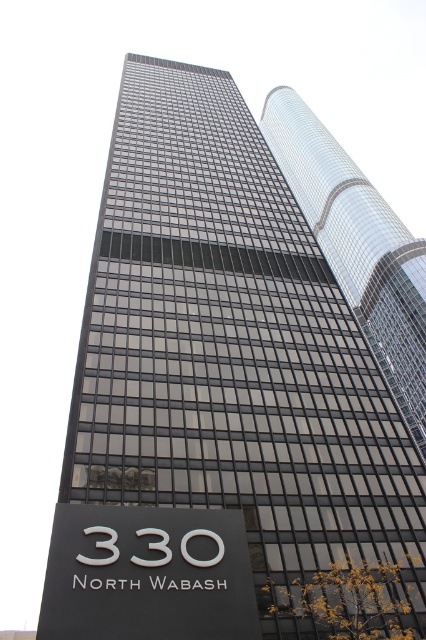
Question: Which point is farther to the camera?

Choices:
 (A) (397, 403)
 (B) (94, 563)
 (C) (189, 564)

Answer: (A)

Question: From the image, what is the correct spatial relationship of black matte sign at lower center in relation to glossy glass skyscraper at upper center?

Choices:
 (A) above
 (B) below

Answer: (B)

Question: Among these points, which one is farthest from the camera?

Choices:
 (A) (331, 154)
 (B) (88, 557)
 (C) (192, 532)

Answer: (A)

Question: Is black matte sign at lower center to the left of glossy glass skyscraper at upper center from the viewer's perspective?

Choices:
 (A) no
 (B) yes

Answer: (B)

Question: Which of these objects is positioned closest to the white glossy sign at center?

Choices:
 (A) black matte sign at lower center
 (B) glossy glass skyscraper at upper center

Answer: (A)

Question: Can you confirm if black matte sign at lower center is positioned below white glossy sign at center?

Choices:
 (A) no
 (B) yes

Answer: (B)